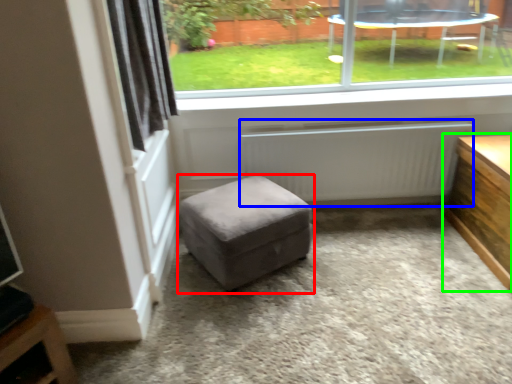
Question: Which object is positioned closest to stool (highlighted by a red box)? Select from radiator (highlighted by a blue box) and table (highlighted by a green box).

Choices:
 (A) radiator
 (B) table

Answer: (A)